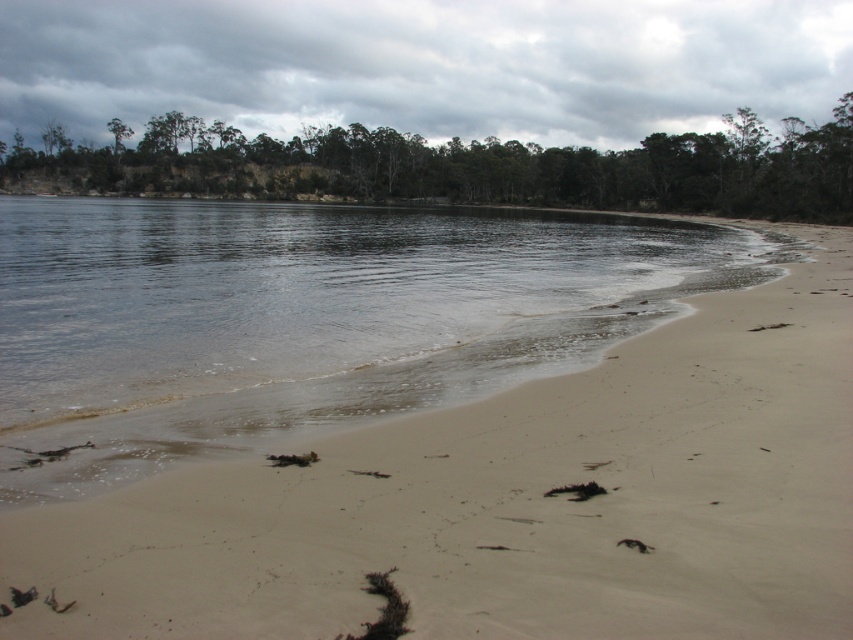
From the picture: You are standing on the beach and want to take a photo of the green leafy trees at upper center and the clear water at center. Which object should you point your camera towards first if you want to capture both in a single shot?

You should point your camera towards the green leafy trees at upper center first because they are located to the left of the clear water at center, allowing both to be captured in the frame when positioned correctly.